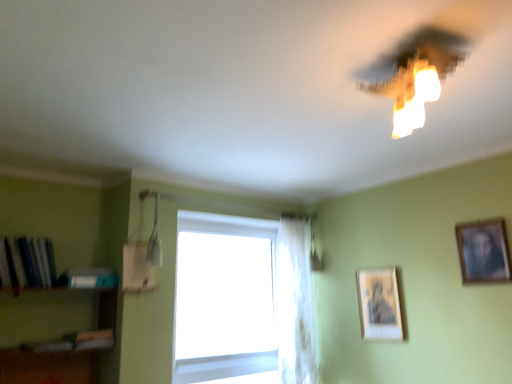
Identify the location of wooden shelf at lower left. (53, 314).

In the scene shown: Measure the distance between hardcover book at left, arranged as the 1th book when viewed from the right, and camera.

hardcover book at left, arranged as the 1th book when viewed from the right, is 8.89 feet from camera.

The image size is (512, 384). I want to click on transparent glass window at center, so click(246, 304).

Do you think hardcover book at left, arranged as the 1th book when viewed from the right, is within transparent glass window at center, or outside of it?

hardcover book at left, arranged as the 1th book when viewed from the right, is located beyond the bounds of transparent glass window at center.

Identify the location of window behind the hardcover book at left, arranged as the 1th book when viewed from the right. The height and width of the screenshot is (384, 512). (246, 304).

Consider the image. From the image's perspective, who appears lower, hardcover book at left, arranged as the 1th book when viewed from the right, or transparent glass window at center?

From the image's view, transparent glass window at center is below.

From the image's perspective, is white sheer curtain at center located above wooden shelf at lower left?

Actually, white sheer curtain at center appears below wooden shelf at lower left in the image.

Which is more to the right, white sheer curtain at center or wooden shelf at lower left?

From the viewer's perspective, white sheer curtain at center appears more on the right side.

From a real-world perspective, which object stands above the other?

white sheer curtain at center is physically above.

Which object is wider, white sheer curtain at center or wooden shelf at lower left?

Wider between the two is wooden shelf at lower left.

Which is less distant, (420, 111) or (481, 240)?

Point (420, 111)

Is wooden framed portrait at upper right, marked as the 1th picture frame in a front-to-back arrangement, completely or partially inside matte white light fixture at upper right?

No, wooden framed portrait at upper right, marked as the 1th picture frame in a front-to-back arrangement, is not a part of matte white light fixture at upper right.

Based on the photo, in terms of height, does matte white light fixture at upper right look taller or shorter compared to wooden framed portrait at upper right, the first picture frame positioned from the right?

Clearly, matte white light fixture at upper right is shorter compared to wooden framed portrait at upper right, the first picture frame positioned from the right.

The width and height of the screenshot is (512, 384). I want to click on the 1st picture frame directly above the transparent glass window at center (from a real-world perspective), so click(x=379, y=304).

From a real-world perspective, is matte gold picture frame at center-right, arranged as the 1th picture frame when ordered from the bottom, positioned over transparent glass window at center based on gravity?

Yes, from a real-world perspective, matte gold picture frame at center-right, arranged as the 1th picture frame when ordered from the bottom, is over transparent glass window at center

Could you measure the distance between matte gold picture frame at center-right, which is the 2th picture frame in front-to-back order, and transparent glass window at center?

matte gold picture frame at center-right, which is the 2th picture frame in front-to-back order, and transparent glass window at center are 31.25 inches apart from each other.

Based on the photo, can you confirm if matte gold picture frame at center-right, arranged as the 1th picture frame when ordered from the bottom, is thinner than white sheer curtain at center?

Correct, the width of matte gold picture frame at center-right, arranged as the 1th picture frame when ordered from the bottom, is less than that of white sheer curtain at center.

Does matte gold picture frame at center-right, which is the 2th picture frame in front-to-back order, lie in front of white sheer curtain at center?

Yes, it is.

Does matte gold picture frame at center-right, positioned as the 2th picture frame in top-to-bottom order, have a larger size compared to white sheer curtain at center?

No, matte gold picture frame at center-right, positioned as the 2th picture frame in top-to-bottom order, is not bigger than white sheer curtain at center.

Considering the relative sizes of matte gold picture frame at center-right, positioned as the 2th picture frame in top-to-bottom order, and white sheer curtain at center in the image provided, is matte gold picture frame at center-right, positioned as the 2th picture frame in top-to-bottom order, shorter than white sheer curtain at center?

Indeed, matte gold picture frame at center-right, positioned as the 2th picture frame in top-to-bottom order, has a lesser height compared to white sheer curtain at center.

From the picture: Do you think shiny blue book at left, marked as the second book in a right-to-left arrangement, is within hardcover book at left, arranged as the 2th book when viewed from the left, or outside of it?

shiny blue book at left, marked as the second book in a right-to-left arrangement, is spatially situated outside hardcover book at left, arranged as the 2th book when viewed from the left.

Which is behind, point (19, 254) or point (78, 271)?

The point (78, 271) is more distant.

Is the surface of shiny blue book at left, marked as the second book in a right-to-left arrangement, in direct contact with hardcover book at left, arranged as the 1th book when viewed from the right?

No, shiny blue book at left, marked as the second book in a right-to-left arrangement, is not making contact with hardcover book at left, arranged as the 1th book when viewed from the right.

Between shiny blue book at left, marked as the second book in a right-to-left arrangement, and hardcover book at left, arranged as the 2th book when viewed from the left, which one appears on the right side from the viewer's perspective?

hardcover book at left, arranged as the 2th book when viewed from the left, is more to the right.

Is wooden framed portrait at upper right, which is the second picture frame in back-to-front order, inside white sheer curtain at center?

No.

Is white sheer curtain at center with wooden framed portrait at upper right, the first picture frame when ordered from top to bottom?

They are not placed beside each other.

Between white sheer curtain at center and wooden framed portrait at upper right, the first picture frame positioned from the right, which one is positioned in front?

wooden framed portrait at upper right, the first picture frame positioned from the right.

Which of these two, white sheer curtain at center or wooden framed portrait at upper right, which is the second picture frame in back-to-front order, is wider?

Wider between the two is white sheer curtain at center.

Image resolution: width=512 pixels, height=384 pixels. I want to click on window behind the hardcover book at left, arranged as the 1th book when viewed from the right, so click(x=246, y=304).

Locate an element on the screen. The width and height of the screenshot is (512, 384). shelf below the white sheer curtain at center (from a real-world perspective) is located at coordinates coord(53,314).

Looking at the image, which one is located closer to matte gold picture frame at center-right, arranged as the 1th picture frame when ordered from the bottom, white sheer curtain at center or wooden framed portrait at upper right, marked as the 1th picture frame in a front-to-back arrangement?

white sheer curtain at center lies closer to matte gold picture frame at center-right, arranged as the 1th picture frame when ordered from the bottom, than the other object.

Which object lies further to the anchor point white sheer curtain at center, wooden framed portrait at upper right, the first picture frame when ordered from top to bottom, or matte white light fixture at upper right?

matte white light fixture at upper right.

Estimate the real-world distances between objects in this image. Which object is further from hardcover book at left, arranged as the 2th book when viewed from the left, wooden shelf at lower left or white sheer curtain at center?

white sheer curtain at center is positioned further to the anchor hardcover book at left, arranged as the 2th book when viewed from the left.

Based on their spatial positions, is matte gold picture frame at center-right, which is counted as the first picture frame, starting from the left, or wooden framed portrait at upper right, which is counted as the second picture frame, starting from the left, further from wooden shelf at lower left?

wooden framed portrait at upper right, which is counted as the second picture frame, starting from the left.

When comparing their distances from matte white light fixture at upper right, does shiny blue book at left, marked as the second book in a right-to-left arrangement, or wooden framed portrait at upper right, marked as the 1th picture frame in a front-to-back arrangement, seem further?

Among the two, shiny blue book at left, marked as the second book in a right-to-left arrangement, is located further to matte white light fixture at upper right.

Based on their spatial positions, is matte gold picture frame at center-right, which is counted as the first picture frame, starting from the left, or wooden shelf at lower left further from shiny blue book at left, marked as the second book in a right-to-left arrangement?

matte gold picture frame at center-right, which is counted as the first picture frame, starting from the left.

From the image, which object appears to be farther from matte gold picture frame at center-right, the 1th picture frame from the back, wooden framed portrait at upper right, the first picture frame when ordered from top to bottom, or shiny blue book at left, marked as the second book in a right-to-left arrangement?

Based on the image, shiny blue book at left, marked as the second book in a right-to-left arrangement, appears to be further to matte gold picture frame at center-right, the 1th picture frame from the back.

From the image, which object appears to be farther from matte white light fixture at upper right, white sheer curtain at center or wooden shelf at lower left?

wooden shelf at lower left is positioned further to the anchor matte white light fixture at upper right.

Find the location of a particular element. This screenshot has height=384, width=512. curtain between transparent glass window at center and wooden framed portrait at upper right, which appears as the second picture frame when ordered from the bottom, in the horizontal direction is located at coordinates (295, 304).

The height and width of the screenshot is (384, 512). Find the location of `light fixture situated between wooden shelf at lower left and wooden framed portrait at upper right, which is the second picture frame in back-to-front order, from left to right`. light fixture situated between wooden shelf at lower left and wooden framed portrait at upper right, which is the second picture frame in back-to-front order, from left to right is located at coordinates (415, 74).

The width and height of the screenshot is (512, 384). I want to click on picture frame positioned between matte white light fixture at upper right and matte gold picture frame at center-right, which is counted as the first picture frame, starting from the left, from near to far, so click(x=483, y=251).

Locate an element on the screen. This screenshot has height=384, width=512. curtain between wooden shelf at lower left and matte white light fixture at upper right from left to right is located at coordinates (295, 304).